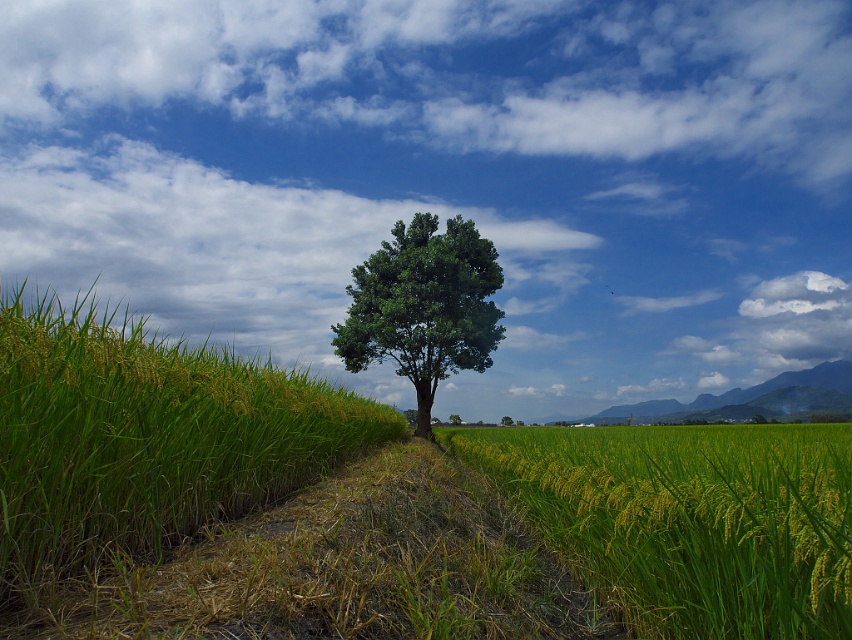
Can you confirm if green leafy tree at center is positioned to the left of green matte tree at center?

Correct, you'll find green leafy tree at center to the left of green matte tree at center.

Does green leafy tree at center appear under green matte tree at center?

No, green leafy tree at center is not below green matte tree at center.

Image resolution: width=852 pixels, height=640 pixels. I want to click on green leafy tree at center, so click(x=423, y=307).

Consider the image. Does green leafy tree at center appear over green grassy hillside at lower right?

Yes.

Is green leafy tree at center taller than green grassy hillside at lower right?

Yes.

Describe the element at coordinates (423, 307) in the screenshot. I see `green leafy tree at center` at that location.

The image size is (852, 640). Identify the location of green leafy tree at center. (423, 307).

Is green grassy hillside at lower right shorter than green matte tree at center?

No, green grassy hillside at lower right is not shorter than green matte tree at center.

Measure the distance between point (726, 400) and camera.

Point (726, 400) and camera are 209.24 feet apart.

The height and width of the screenshot is (640, 852). What do you see at coordinates (744, 390) in the screenshot?
I see `green grassy hillside at lower right` at bounding box center [744, 390].

In order to click on green grassy hillside at lower right in this screenshot , I will do `click(744, 390)`.